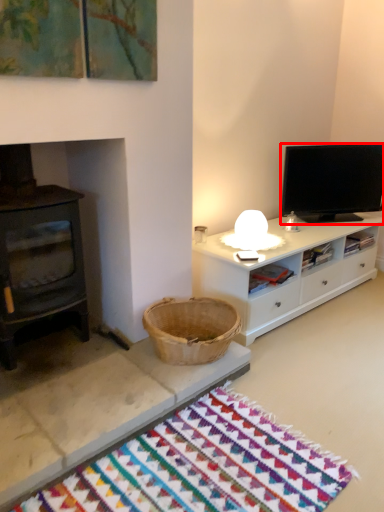
Question: In this image, where is television (annotated by the red box) located relative to mat?

Choices:
 (A) right
 (B) left

Answer: (A)